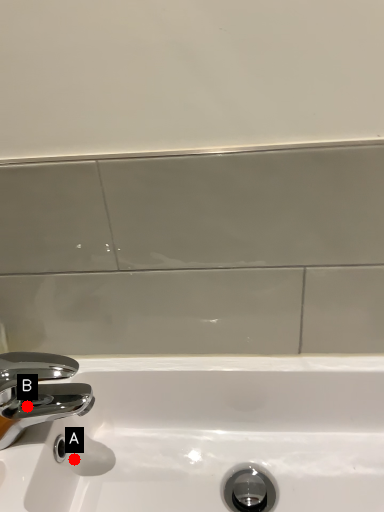
Question: Two points are circled on the image, labeled by A and B beside each circle. Among these points, which one is farthest from the camera?

Choices:
 (A) A is further
 (B) B is further

Answer: (A)